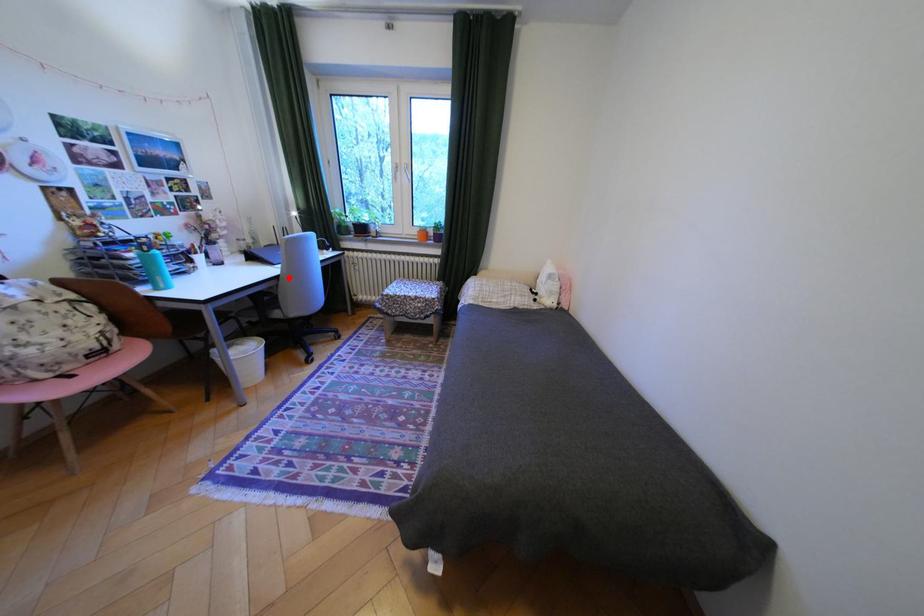
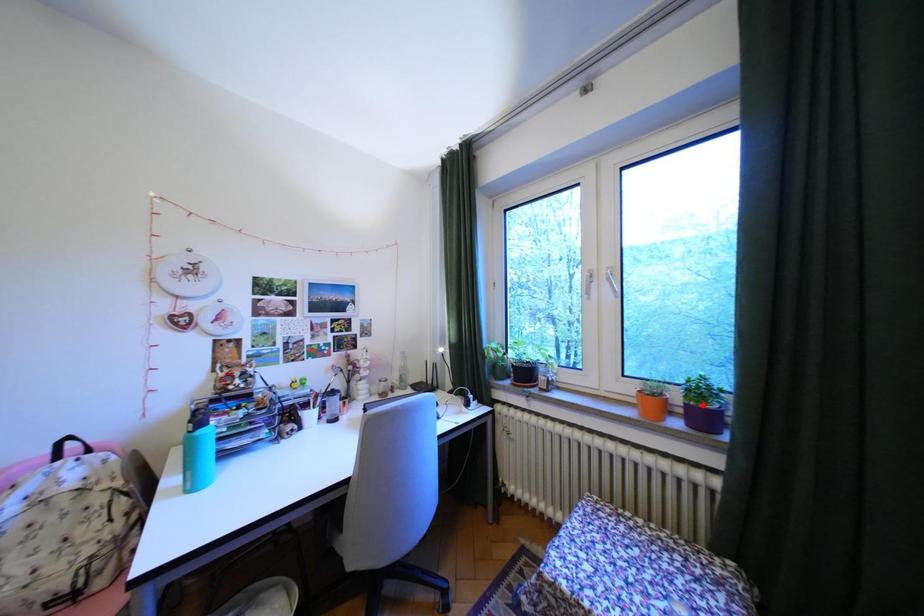
I am providing you with two images of the same scene from different viewpoints. A red point is marked on the first image and another point is marked on the second image. Is the marked point in image1 the same physical position as the marked point in image2?

No